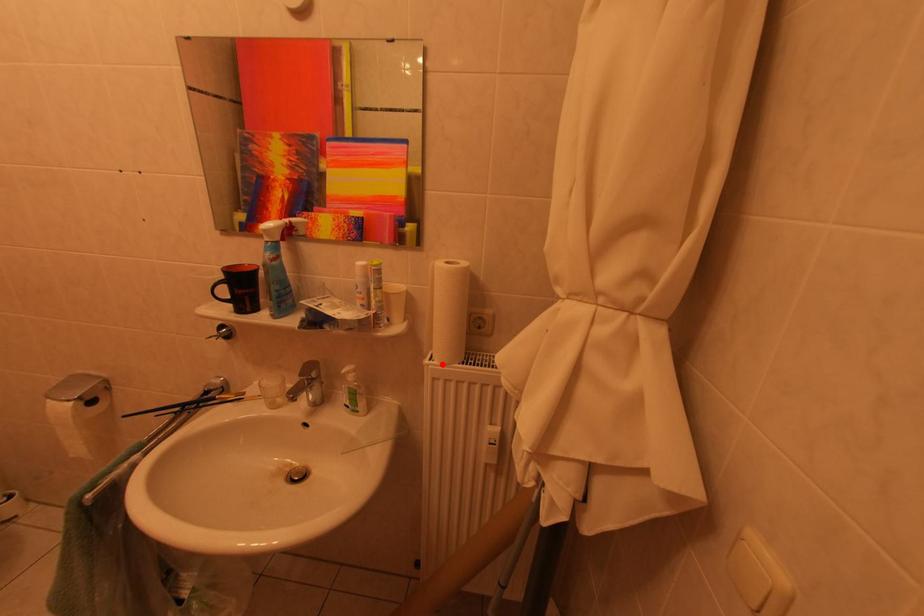
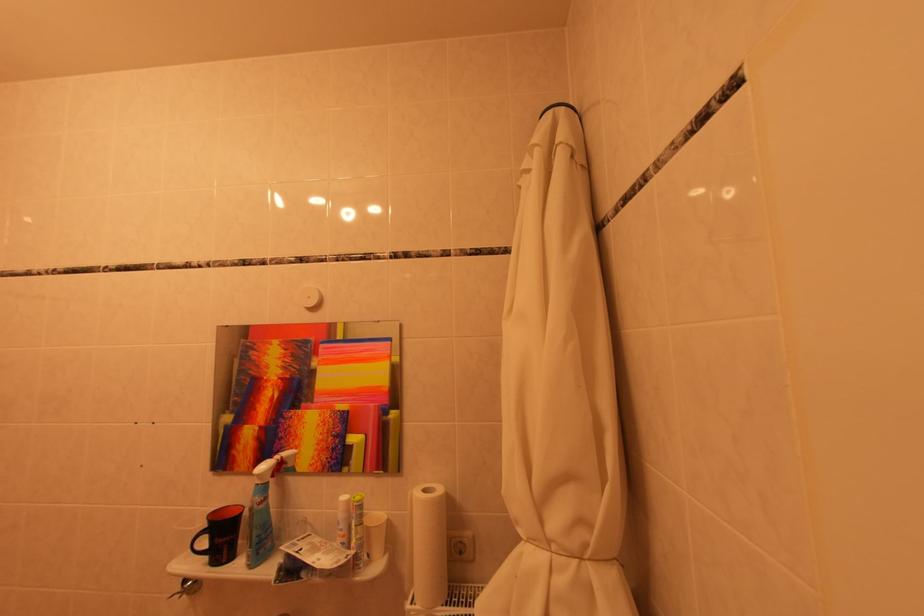
Where in the second image is the point corresponding to the highlighted location from the first image?

(423, 608)